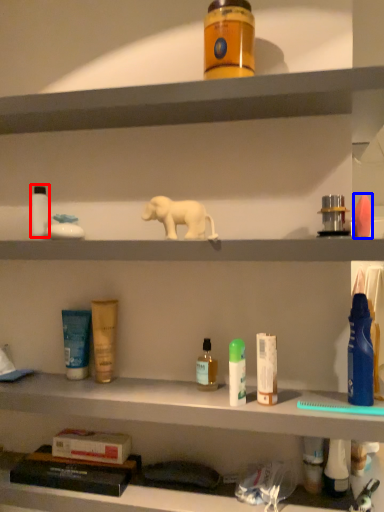
Question: Which of the following is the closest to the observer, toiletry (highlighted by a red box) or toiletry (highlighted by a blue box)?

Choices:
 (A) toiletry
 (B) toiletry

Answer: (B)